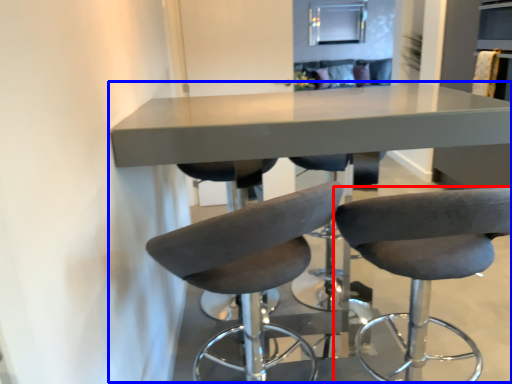
Question: Which of the following is the farthest to the observer, chair (highlighted by a red box) or table (highlighted by a blue box)?

Choices:
 (A) chair
 (B) table

Answer: (B)